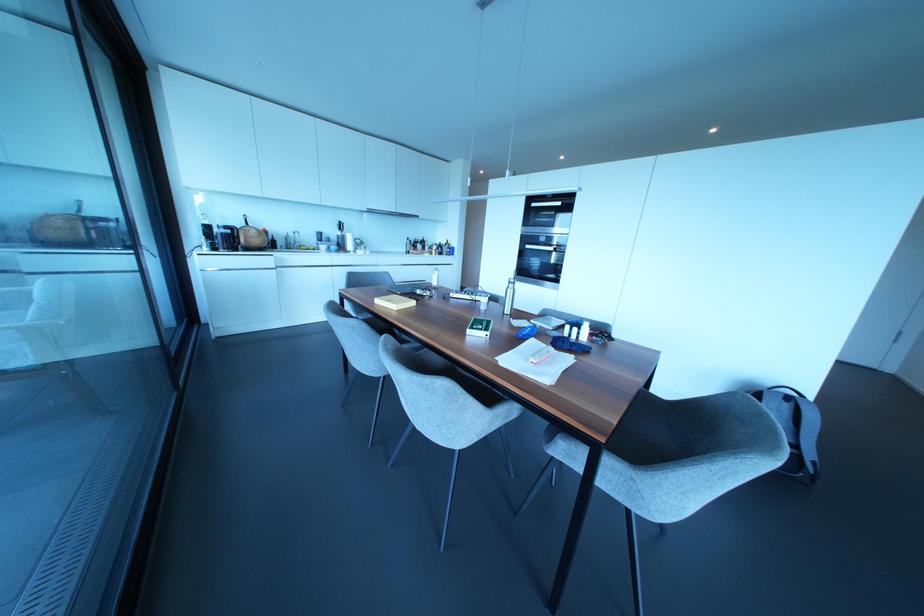
Find where to slid the sliding door handle. Please return your answer as a coordinate pair (x, y).

(137, 246)